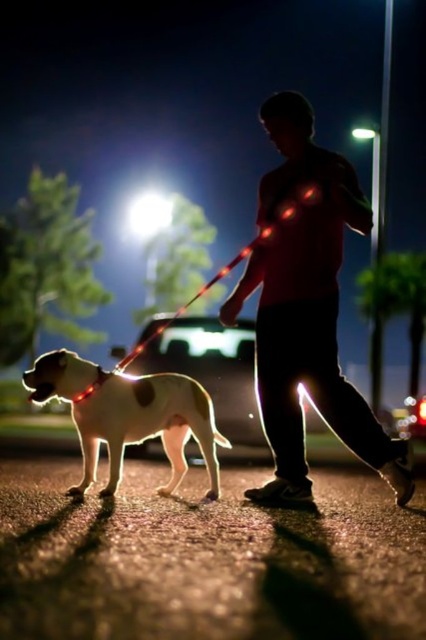
Does black matte shirt at center have a lesser width compared to shiny white dog at center?

Indeed, black matte shirt at center has a lesser width compared to shiny white dog at center.

Which is in front, point (325, 380) or point (88, 465)?

Point (325, 380) is more forward.

Is point (307, 316) closer to viewer compared to point (161, 400)?

Yes, it is in front of point (161, 400).

The height and width of the screenshot is (640, 426). What are the coordinates of `black matte shirt at center` in the screenshot? It's located at (307, 308).